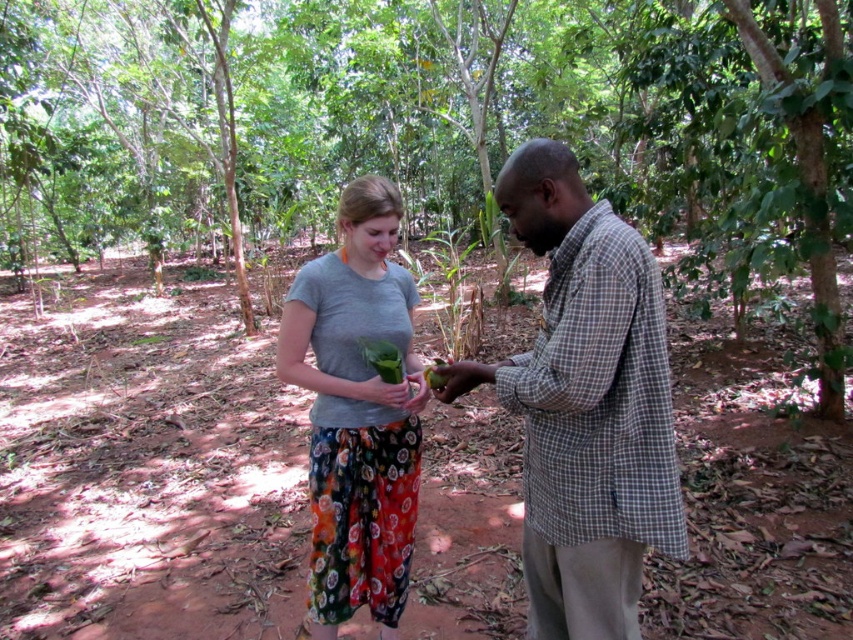
You are a botanist in the forest and need to identify which object is taller between the green leafy tree at center and the green leafy vegetable at center. Based on their positions, which one is taller?

The green leafy tree at center is taller than the green leafy vegetable at center.